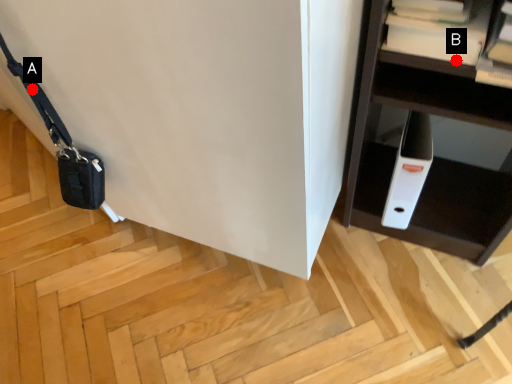
Question: Two points are circled on the image, labeled by A and B beside each circle. Which point is closer to the camera?

Choices:
 (A) A is closer
 (B) B is closer

Answer: (B)